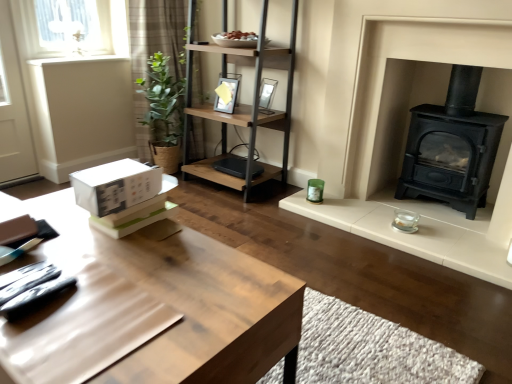
What are the coordinates of `free spot above light brown wooden table at center (from a real-world perspective)` in the screenshot? It's located at (115, 270).